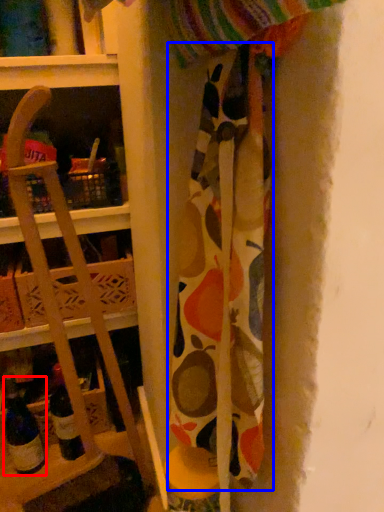
Question: Which object is further to the camera taking this photo, wine bottle (highlighted by a red box) or fabric (highlighted by a blue box)?

Choices:
 (A) wine bottle
 (B) fabric

Answer: (A)